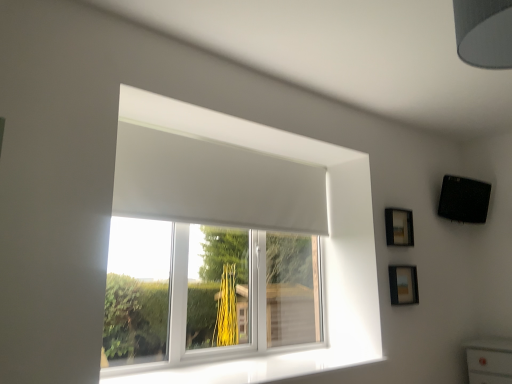
Question: From the image's perspective, relative to white matte window at center, is gray fabric lampshade at upper right above or below?

Choices:
 (A) above
 (B) below

Answer: (A)

Question: Is gray fabric lampshade at upper right wider or thinner than white matte window at center?

Choices:
 (A) thin
 (B) wide

Answer: (B)

Question: Based on their relative distances, which object is nearer to the white glossy window sill at lower center?

Choices:
 (A) wooden frame at upper right, acting as the first picture frame starting from the top
 (B) gray fabric lampshade at upper right
 (C) matte black picture frame at lower right, the 1th picture frame positioned from the bottom
 (D) white matte window at center

Answer: (D)

Question: Estimate the real-world distances between objects in this image. Which object is closer to the gray fabric lampshade at upper right?

Choices:
 (A) matte black picture frame at lower right, the 2th picture frame when ordered from top to bottom
 (B) wooden frame at upper right, acting as the first picture frame starting from the top
 (C) white glossy window sill at lower center
 (D) white matte window at center

Answer: (D)